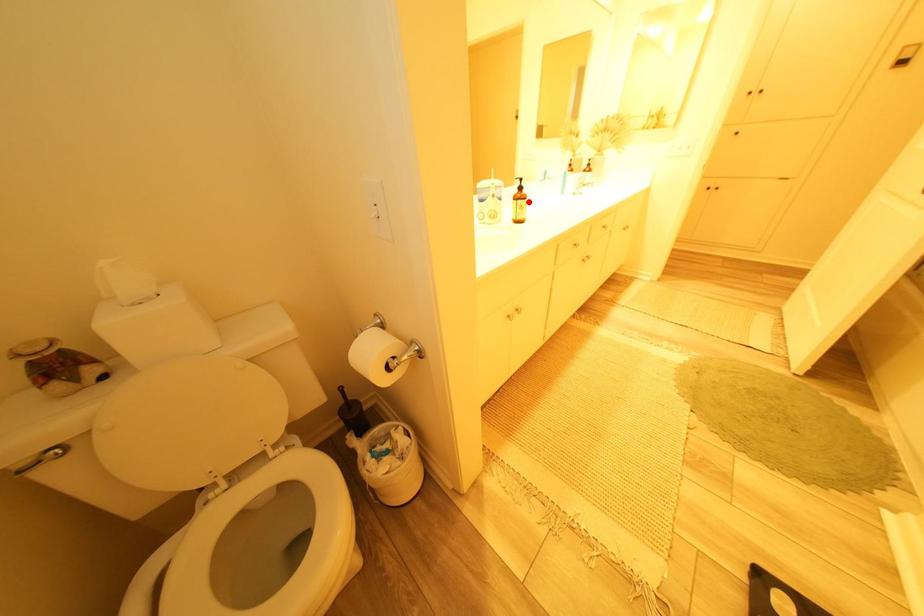
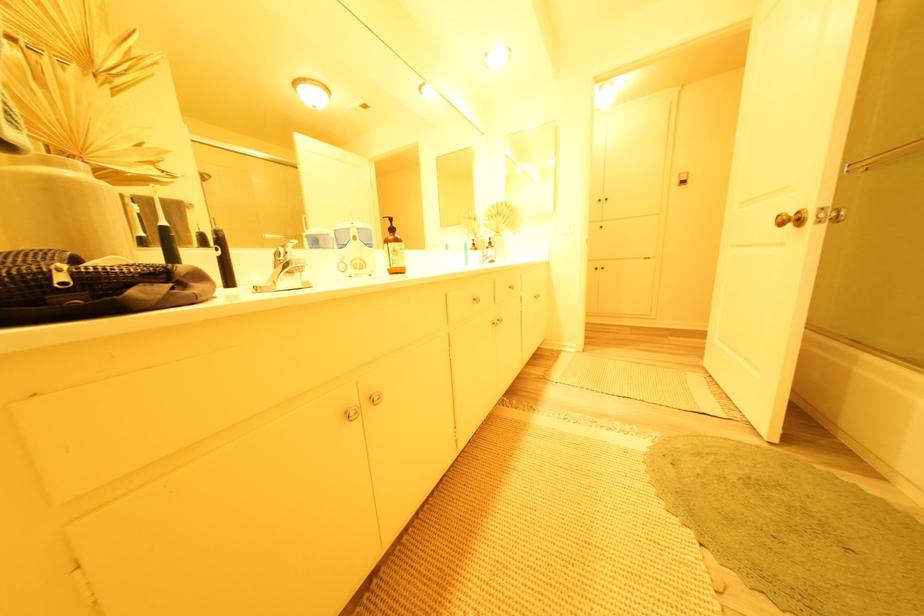
The point at the highlighted location is marked in the first image. Where is the corresponding point in the second image?

(399, 245)